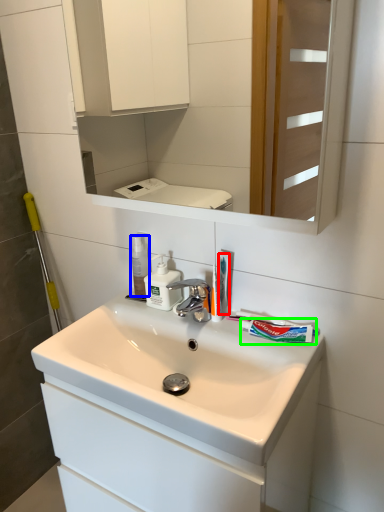
Question: Based on their relative distances, which object is nearer to toothbrush (highlighted by a red box)? Choose from mouthwash (highlighted by a blue box) and toothpaste (highlighted by a green box).

Choices:
 (A) mouthwash
 (B) toothpaste

Answer: (B)